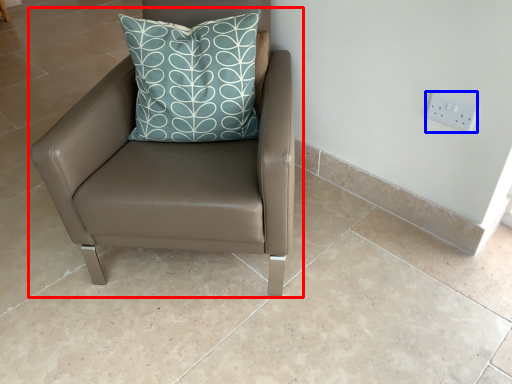
Question: Which point is closer to the camera, chair (highlighted by a red box) or electric outlet (highlighted by a blue box)?

Choices:
 (A) chair
 (B) electric outlet

Answer: (A)